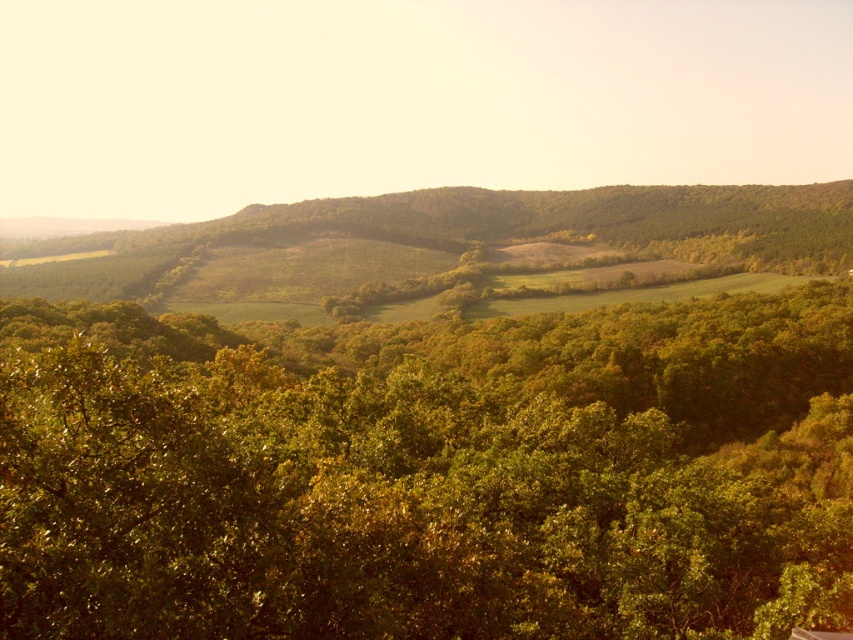
Does green leafy trees at center come behind green leafy hillside at center?

That is False.

Can you confirm if green leafy trees at center is shorter than green leafy hillside at center?

Correct, green leafy trees at center is not as tall as green leafy hillside at center.

Describe the element at coordinates (430, 474) in the screenshot. I see `green leafy trees at center` at that location.

What are the coordinates of `green leafy trees at center` in the screenshot? It's located at (430, 474).